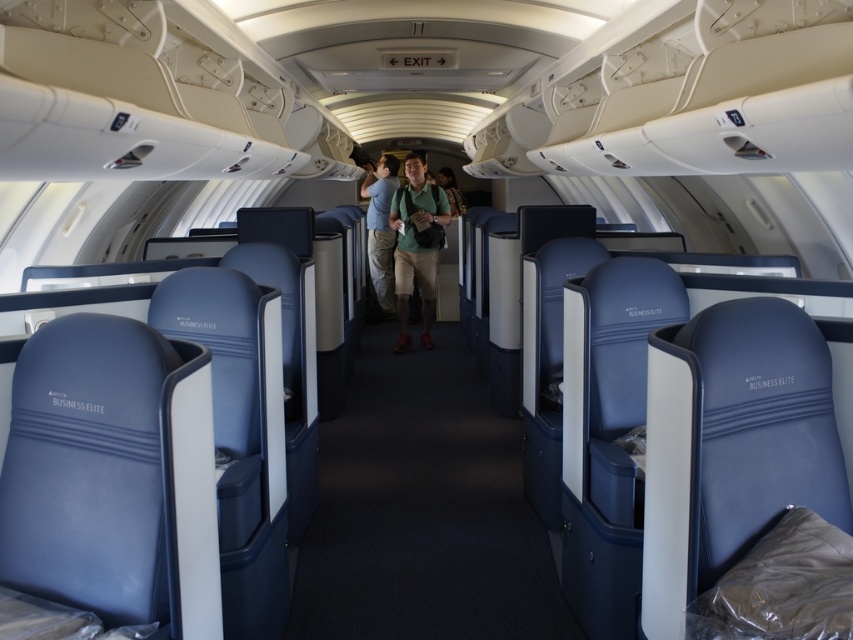
You are a flight attendant checking the overhead compartments in the business class section. You notice two shirts hanging inside one of the compartments. The green fabric shirt at center and the matte blue shirt at center. Which shirt is closer to the bottom of the compartment?

The green fabric shirt at center is below the matte blue shirt at center, so the green fabric shirt at center is closer to the bottom of the compartment.

You are a flight attendant observing passengers in the business class section. You notice two passengers wearing shirts at center. Which passenger is wearing the green fabric shirt at center located to the right of the matte blue shirt at center?

The green fabric shirt at center is positioned on the right side of matte blue shirt at center, so the passenger wearing the green fabric shirt at center is located to the right of the one wearing the matte blue shirt at center.